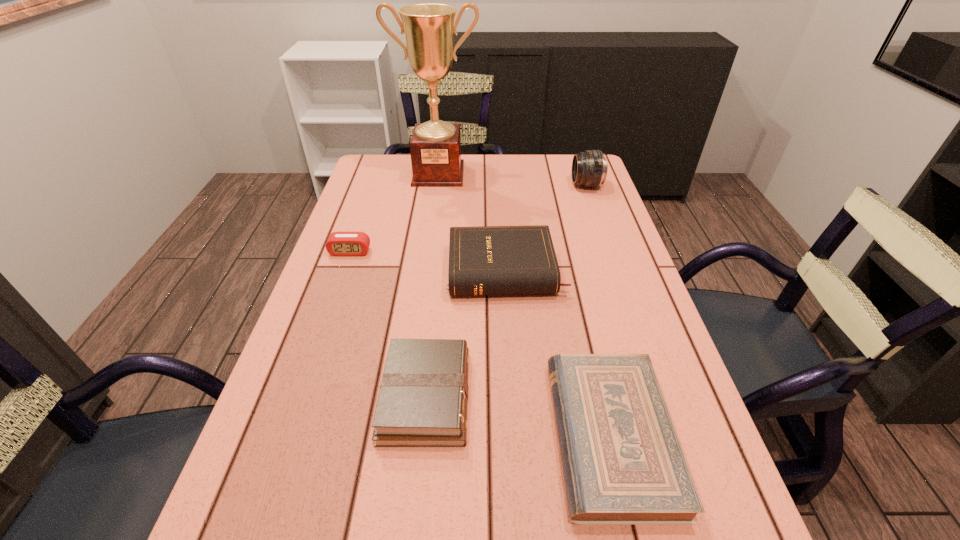
Identify the location of alarm clock that is at the left edge. (339, 243).

This screenshot has width=960, height=540. What are the coordinates of `telephoto lens present at the right edge` in the screenshot? It's located at (589, 168).

What are the coordinates of `Bible at the right edge` in the screenshot? It's located at (623, 464).

At what (x,y) coordinates should I click in order to perform the action: click on object that is at the far left corner. Please return your answer as a coordinate pair (x, y). The image size is (960, 540). Looking at the image, I should click on (435, 147).

I want to click on object present at the far right corner, so click(589, 168).

In the image, there is a desktop. At what (x,y) coordinates should I click in order to perform the action: click on vacant space at the far edge. Please return your answer as a coordinate pair (x, y). The image size is (960, 540). Looking at the image, I should click on (546, 179).

In the image, there is a desktop. Identify the location of vacant region at the left edge. (334, 352).

At what (x,y) coordinates should I click in order to perform the action: click on vacant space at the right edge. Please return your answer as a coordinate pair (x, y). Looking at the image, I should click on (634, 302).

This screenshot has height=540, width=960. In the image, there is a desktop. What are the coordinates of `vacant space at the far left corner` in the screenshot? It's located at (401, 187).

At what (x,y) coordinates should I click in order to perform the action: click on free space that is in between the fifth shortest object and the trophy cup. Please return your answer as a coordinate pair (x, y). The height and width of the screenshot is (540, 960). Looking at the image, I should click on (513, 179).